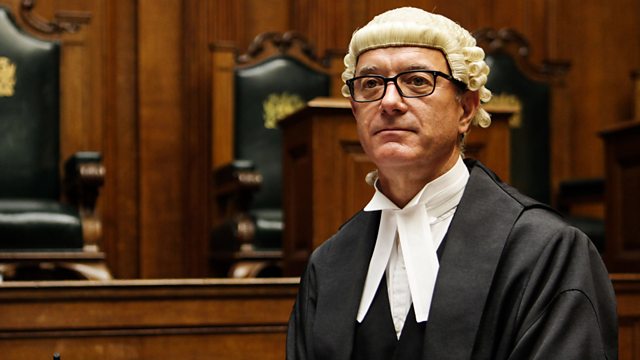
In order to click on wall in this screenshot , I will do `click(211, 20)`.